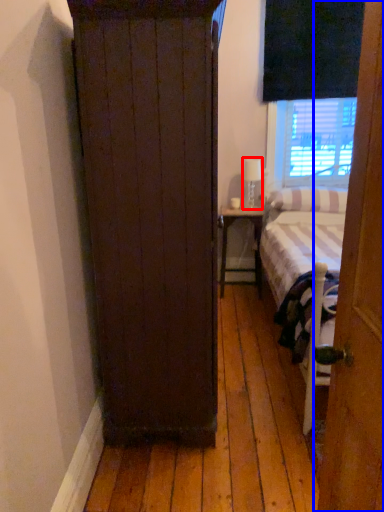
Question: Which object appears closest to the camera in this image, lamp (highlighted by a red box) or door (highlighted by a blue box)?

Choices:
 (A) lamp
 (B) door

Answer: (B)